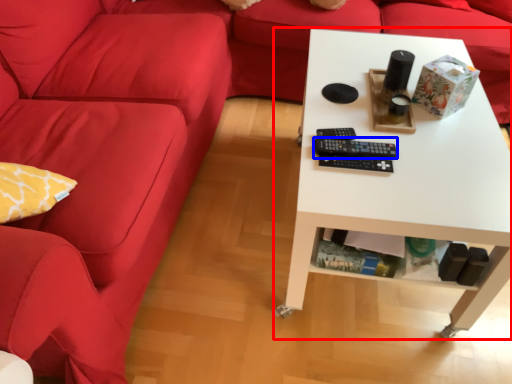
Question: Which object appears farthest to the camera in this image, table (highlighted by a red box) or control (highlighted by a blue box)?

Choices:
 (A) table
 (B) control

Answer: (B)